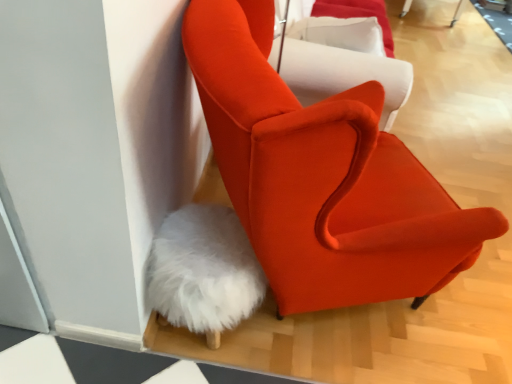
What do you see at coordinates (343, 74) in the screenshot? This screenshot has height=384, width=512. I see `orange fabric chair at upper center, acting as the 2th chair starting from the bottom` at bounding box center [343, 74].

In order to click on orange fabric chair at upper center, which is the 1th chair in top-to-bottom order in this screenshot , I will do point(343,74).

The image size is (512, 384). What do you see at coordinates (322, 177) in the screenshot?
I see `matte orange armchair at center, which appears as the first chair when ordered from the bottom` at bounding box center [322, 177].

How much space does matte orange armchair at center, which appears as the first chair when ordered from the bottom, occupy vertically?

39.01 inches.

What are the coordinates of `matte orange armchair at center, the second chair in the top-to-bottom sequence` in the screenshot? It's located at (322, 177).

What is the approximate width of matte orange armchair at center, the second chair in the top-to-bottom sequence?

matte orange armchair at center, the second chair in the top-to-bottom sequence, is 36.54 inches wide.

Locate an element on the screen. orange fabric chair at upper center, which is the 1th chair in top-to-bottom order is located at coordinates (343, 74).

Between matte orange armchair at center, which appears as the first chair when ordered from the bottom, and orange fabric chair at upper center, acting as the 2th chair starting from the bottom, which one appears on the left side from the viewer's perspective?

From the viewer's perspective, matte orange armchair at center, which appears as the first chair when ordered from the bottom, appears more on the left side.

Is matte orange armchair at center, which appears as the first chair when ordered from the bottom, further to camera compared to orange fabric chair at upper center, which is the 1th chair in top-to-bottom order?

No, matte orange armchair at center, which appears as the first chair when ordered from the bottom, is closer to the viewer.

Between point (342, 97) and point (327, 59), which one is positioned in front?

Point (342, 97)

From the image's perspective, is matte orange armchair at center, which appears as the first chair when ordered from the bottom, above or below orange fabric chair at upper center, which is the 1th chair in top-to-bottom order?

matte orange armchair at center, which appears as the first chair when ordered from the bottom, is situated lower than orange fabric chair at upper center, which is the 1th chair in top-to-bottom order, in the image.

From a real-world perspective, which object rests below the other?

matte orange armchair at center, which appears as the first chair when ordered from the bottom.

Can you confirm if matte orange armchair at center, which appears as the first chair when ordered from the bottom, is wider than orange fabric chair at upper center, which is the 1th chair in top-to-bottom order?

Correct, the width of matte orange armchair at center, which appears as the first chair when ordered from the bottom, exceeds that of orange fabric chair at upper center, which is the 1th chair in top-to-bottom order.

Can you confirm if matte orange armchair at center, which appears as the first chair when ordered from the bottom, is taller than orange fabric chair at upper center, which is the 1th chair in top-to-bottom order?

Yes, matte orange armchair at center, which appears as the first chair when ordered from the bottom, is taller than orange fabric chair at upper center, which is the 1th chair in top-to-bottom order.

Can you confirm if matte orange armchair at center, the second chair in the top-to-bottom sequence, is bigger than orange fabric chair at upper center, acting as the 2th chair starting from the bottom?

Indeed, matte orange armchair at center, the second chair in the top-to-bottom sequence, has a larger size compared to orange fabric chair at upper center, acting as the 2th chair starting from the bottom.

Is matte orange armchair at center, the second chair in the top-to-bottom sequence, not within orange fabric chair at upper center, acting as the 2th chair starting from the bottom?

Yes.

From the picture: Is matte orange armchair at center, the second chair in the top-to-bottom sequence, beside orange fabric chair at upper center, acting as the 2th chair starting from the bottom?

matte orange armchair at center, the second chair in the top-to-bottom sequence, and orange fabric chair at upper center, acting as the 2th chair starting from the bottom, are not in contact.

Is matte orange armchair at center, the second chair in the top-to-bottom sequence, oriented away from orange fabric chair at upper center, acting as the 2th chair starting from the bottom?

No.

What's the angular difference between matte orange armchair at center, the second chair in the top-to-bottom sequence, and orange fabric chair at upper center, which is the 1th chair in top-to-bottom order,'s facing directions?

There is a 54.2-degree angle between the facing directions of matte orange armchair at center, the second chair in the top-to-bottom sequence, and orange fabric chair at upper center, which is the 1th chair in top-to-bottom order.

Based on the photo, how far apart are matte orange armchair at center, which appears as the first chair when ordered from the bottom, and orange fabric chair at upper center, acting as the 2th chair starting from the bottom?

matte orange armchair at center, which appears as the first chair when ordered from the bottom, is 20.99 inches from orange fabric chair at upper center, acting as the 2th chair starting from the bottom.

Find the location of a particular element. The height and width of the screenshot is (384, 512). chair that appears above the matte orange armchair at center, which appears as the first chair when ordered from the bottom (from the image's perspective) is located at coordinates (343, 74).

Is orange fabric chair at upper center, which is the 1th chair in top-to-bottom order, at the left side of matte orange armchair at center, the second chair in the top-to-bottom sequence?

No.

In the scene shown: Who is more distant, orange fabric chair at upper center, acting as the 2th chair starting from the bottom, or matte orange armchair at center, which appears as the first chair when ordered from the bottom?

orange fabric chair at upper center, acting as the 2th chair starting from the bottom.

Which is closer, (347, 88) or (282, 266)?

Point (347, 88).

From the image's perspective, between orange fabric chair at upper center, which is the 1th chair in top-to-bottom order, and matte orange armchair at center, the second chair in the top-to-bottom sequence, who is located below?

From the image's view, matte orange armchair at center, the second chair in the top-to-bottom sequence, is below.

From a real-world perspective, who is located lower, orange fabric chair at upper center, which is the 1th chair in top-to-bottom order, or matte orange armchair at center, the second chair in the top-to-bottom sequence?

matte orange armchair at center, the second chair in the top-to-bottom sequence, is physically lower.

Which object is wider, orange fabric chair at upper center, acting as the 2th chair starting from the bottom, or matte orange armchair at center, which appears as the first chair when ordered from the bottom?

matte orange armchair at center, which appears as the first chair when ordered from the bottom.

Considering the sizes of orange fabric chair at upper center, which is the 1th chair in top-to-bottom order, and matte orange armchair at center, which appears as the first chair when ordered from the bottom, in the image, is orange fabric chair at upper center, which is the 1th chair in top-to-bottom order, taller or shorter than matte orange armchair at center, which appears as the first chair when ordered from the bottom,?

orange fabric chair at upper center, which is the 1th chair in top-to-bottom order, is shorter than matte orange armchair at center, which appears as the first chair when ordered from the bottom.

Is orange fabric chair at upper center, acting as the 2th chair starting from the bottom, bigger or smaller than matte orange armchair at center, the second chair in the top-to-bottom sequence?

Clearly, orange fabric chair at upper center, acting as the 2th chair starting from the bottom, is smaller in size than matte orange armchair at center, the second chair in the top-to-bottom sequence.

Would you say orange fabric chair at upper center, acting as the 2th chair starting from the bottom, is outside matte orange armchair at center, the second chair in the top-to-bottom sequence?

That's correct, orange fabric chair at upper center, acting as the 2th chair starting from the bottom, is outside of matte orange armchair at center, the second chair in the top-to-bottom sequence.

Are orange fabric chair at upper center, which is the 1th chair in top-to-bottom order, and matte orange armchair at center, which appears as the first chair when ordered from the bottom, beside each other?

No, orange fabric chair at upper center, which is the 1th chair in top-to-bottom order, is not beside matte orange armchair at center, which appears as the first chair when ordered from the bottom.

Could you tell me if orange fabric chair at upper center, acting as the 2th chair starting from the bottom, is turned towards matte orange armchair at center, which appears as the first chair when ordered from the bottom?

No, orange fabric chair at upper center, acting as the 2th chair starting from the bottom, does not turn towards matte orange armchair at center, which appears as the first chair when ordered from the bottom.

The image size is (512, 384). What are the coordinates of `chair located below the orange fabric chair at upper center, acting as the 2th chair starting from the bottom (from the image's perspective)` in the screenshot? It's located at (322, 177).

You are a GUI agent. You are given a task and a screenshot of the screen. Output one action in this format:
    pyautogui.click(x=<x>, y=<y>)
    Task: Click on the chair positioned vertically above the matte orange armchair at center, which appears as the first chair when ordered from the bottom (from a real-world perspective)
    The width and height of the screenshot is (512, 384).
    Given the screenshot: What is the action you would take?
    pyautogui.click(x=343, y=74)

This screenshot has width=512, height=384. I want to click on chair in front of the orange fabric chair at upper center, which is the 1th chair in top-to-bottom order, so click(322, 177).